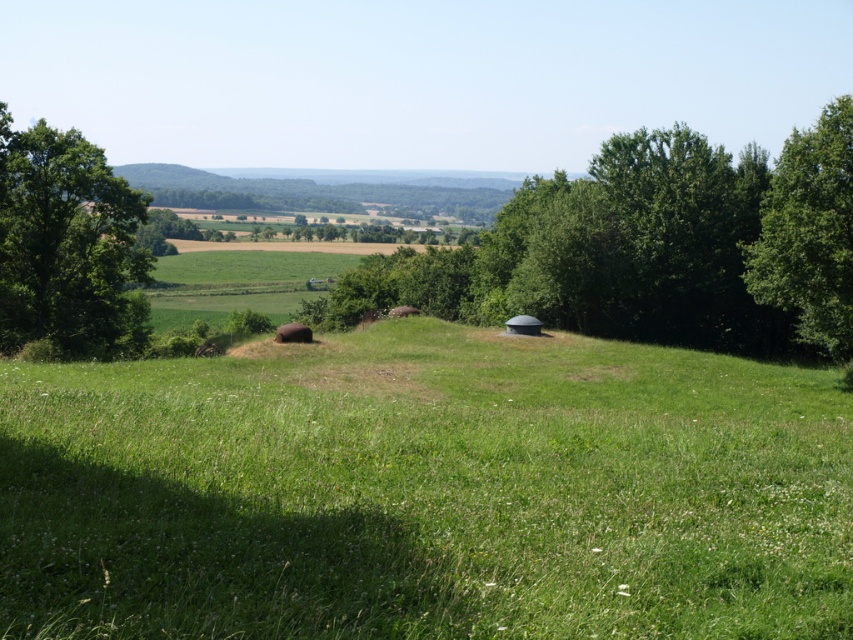
Question: Is green grass at center above green leafy tree at left?

Choices:
 (A) yes
 (B) no

Answer: (B)

Question: Among these objects, which one is farthest from the camera?

Choices:
 (A) green leafy tree at left
 (B) green leafy tree at center
 (C) green leafy tree at right

Answer: (A)

Question: Based on their relative distances, which object is nearer to the green leafy tree at center?

Choices:
 (A) green leafy tree at left
 (B) green grass at center
 (C) green leafy tree at right

Answer: (C)

Question: Does green leafy tree at center come behind green leafy tree at left?

Choices:
 (A) yes
 (B) no

Answer: (B)

Question: Is green grass at center positioned behind green leafy tree at left?

Choices:
 (A) no
 (B) yes

Answer: (A)

Question: Which object is the farthest from the green leafy tree at right?

Choices:
 (A) green grass at center
 (B) green leafy tree at center
 (C) green leafy tree at left

Answer: (C)